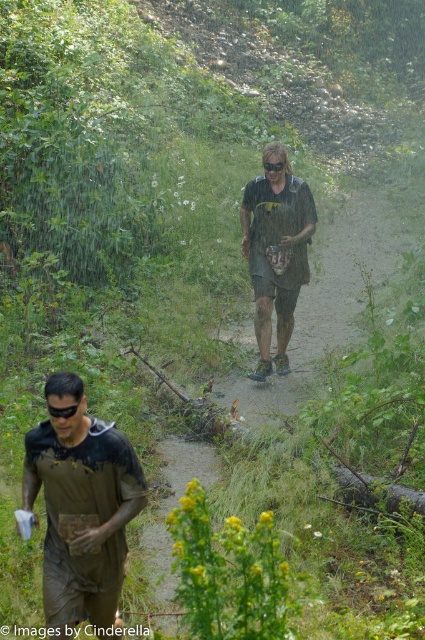
Question: Which point is farther from the camera taking this photo?

Choices:
 (A) (252, 189)
 (B) (116, 596)

Answer: (A)

Question: Does brown mud-covered shirt at lower left have a greater width compared to green fabric shirt at center?

Choices:
 (A) yes
 (B) no

Answer: (B)

Question: In this image, where is brown mud-covered shirt at lower left located relative to green fabric shirt at center?

Choices:
 (A) above
 (B) below

Answer: (B)

Question: Which point is closer to the camera taking this photo?

Choices:
 (A) [76, 474]
 (B) [251, 230]

Answer: (A)

Question: Is brown mud-covered shirt at lower left smaller than green fabric shirt at center?

Choices:
 (A) no
 (B) yes

Answer: (B)